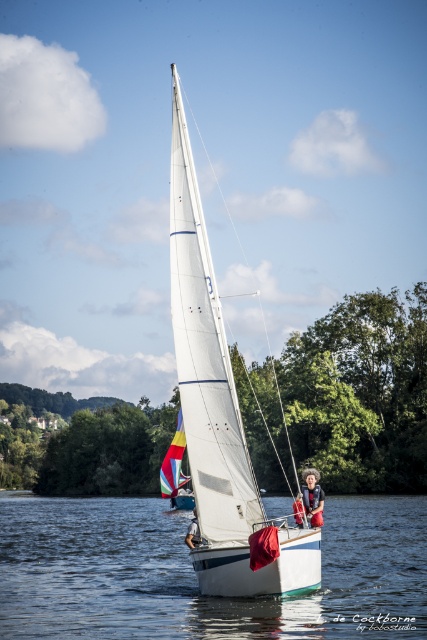
Question: Which point is farther to the camera?

Choices:
 (A) (254, 445)
 (B) (316, 509)
 (C) (353, 513)
 (D) (301, 525)

Answer: (A)

Question: Can you confirm if white glossy water at center is positioned below green leafy tree at center?

Choices:
 (A) no
 (B) yes

Answer: (B)

Question: Is white glossy water at center smaller than green leafy tree at center?

Choices:
 (A) yes
 (B) no

Answer: (B)

Question: Which point is closer to the camera taking this photo?

Choices:
 (A) (315, 476)
 (B) (415, 580)
 (C) (298, 524)

Answer: (C)

Question: Is white glossy water at center further to camera compared to red cotton shirt at center?

Choices:
 (A) yes
 (B) no

Answer: (B)

Question: Which point is farther to the camera?

Choices:
 (A) (139, 410)
 (B) (297, 525)
 (C) (44, 570)

Answer: (A)